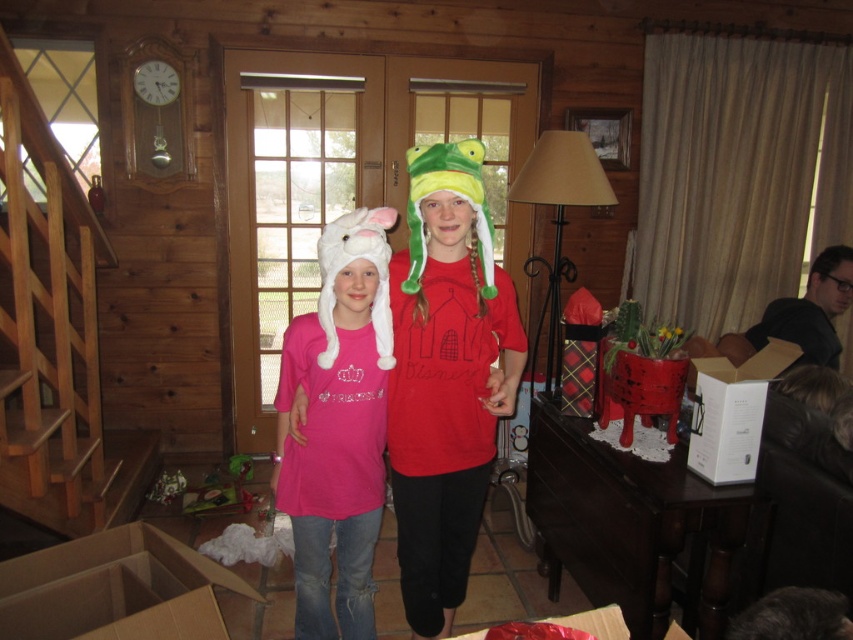
Question: In this image, where is matte green plush hat at center located relative to pink fabric shirt at center?

Choices:
 (A) below
 (B) above

Answer: (B)

Question: Which point is closer to the camera?

Choices:
 (A) white fluffy hat at left
 (B) matte green plush hat at center

Answer: (B)

Question: Which point appears closest to the camera in this image?

Choices:
 (A) (474, 205)
 (B) (215, 614)

Answer: (A)

Question: Which point is closer to the camera?

Choices:
 (A) (695, 364)
 (B) (836, 250)

Answer: (A)

Question: Can you confirm if matte green plush hat at center is wider than cardboard box at lower left?

Choices:
 (A) no
 (B) yes

Answer: (A)

Question: Is cardboard box at lower left below white cardboard box at right?

Choices:
 (A) yes
 (B) no

Answer: (A)